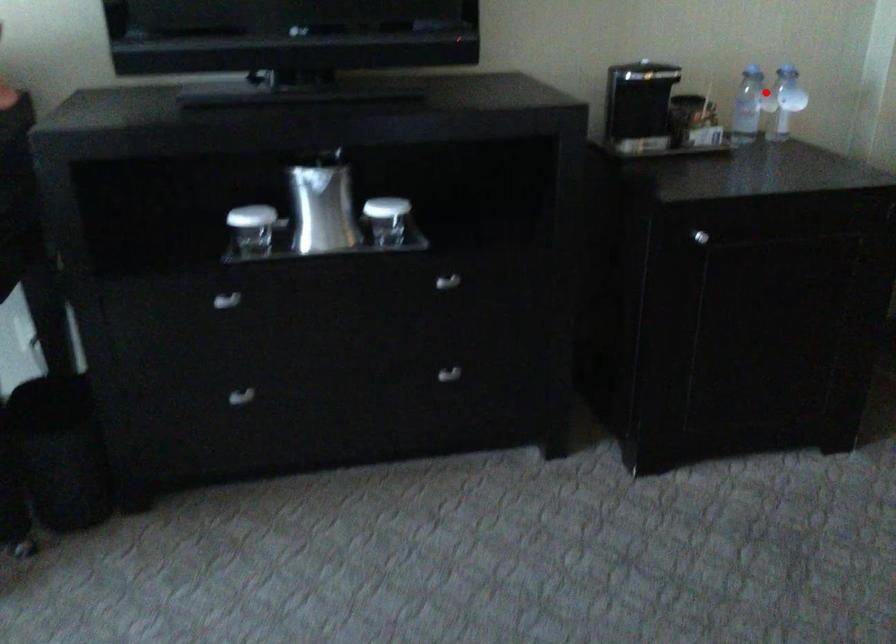
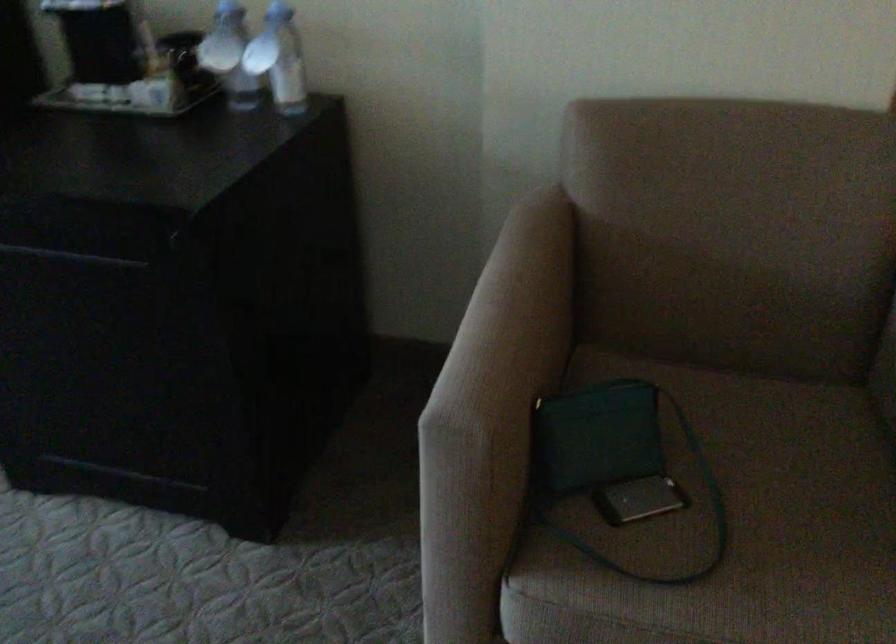
Question: I am providing you with two images of the same scene from different viewpoints. Image1 has a red point marked. In image2, the corresponding 3D location appears at what relative position? Reply with the corresponding letter.

Choices:
 (A) Closer
 (B) Farther

Answer: (A)